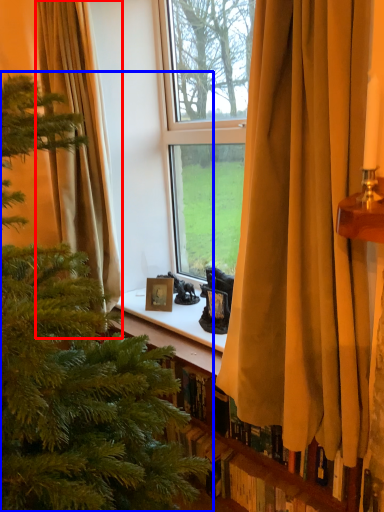
Question: Among these objects, which one is farthest to the camera, curtain (highlighted by a red box) or christmas tree (highlighted by a blue box)?

Choices:
 (A) curtain
 (B) christmas tree

Answer: (A)